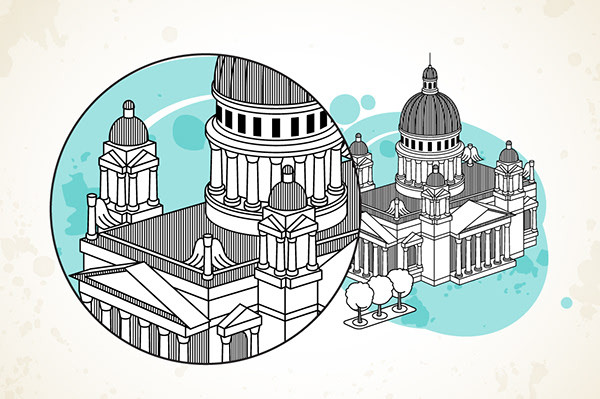
This screenshot has width=600, height=399. What are the coordinates of `pillars` in the screenshot? It's located at (506, 237), (497, 241), (484, 246), (469, 252), (459, 254), (185, 349), (141, 339), (111, 321), (89, 307).